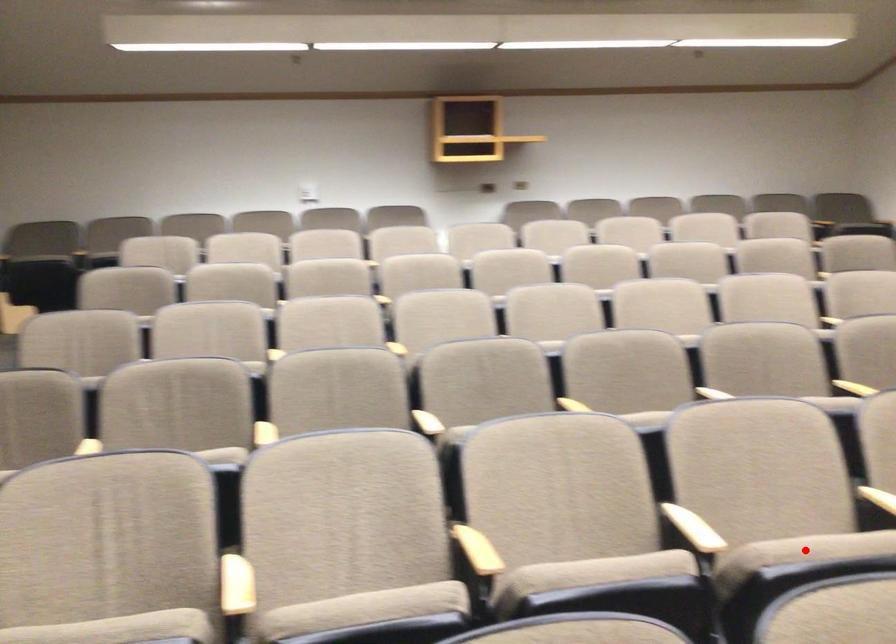
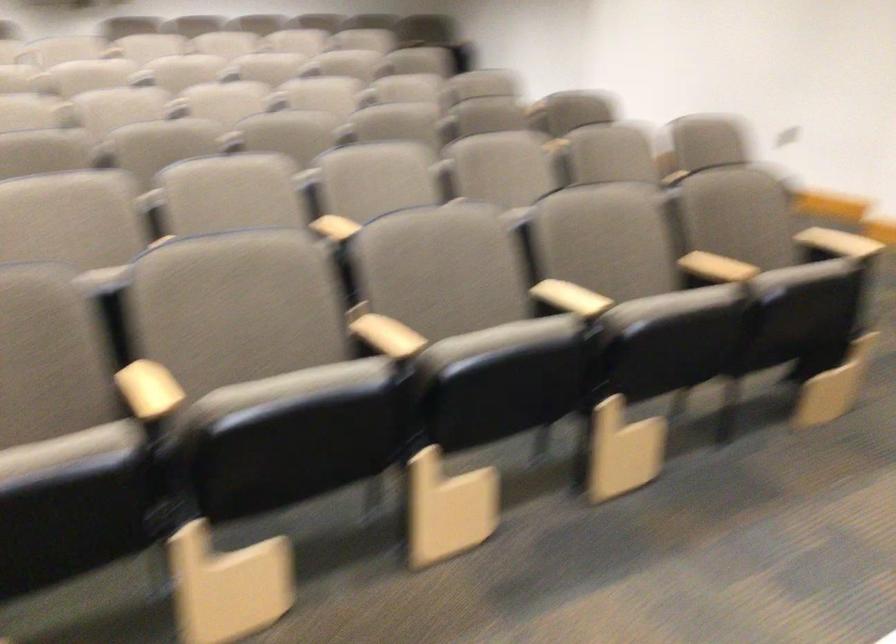
Question: I am providing you with two images of the same scene from different viewpoints. A red point is marked on the first image. Is the red point's position out of view in image 2?

Choices:
 (A) Yes
 (B) No

Answer: (A)